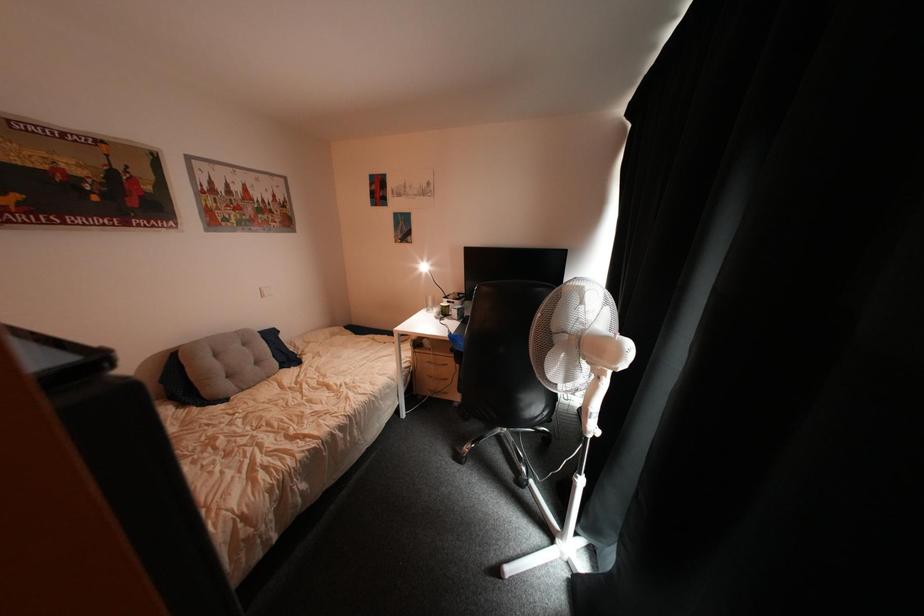
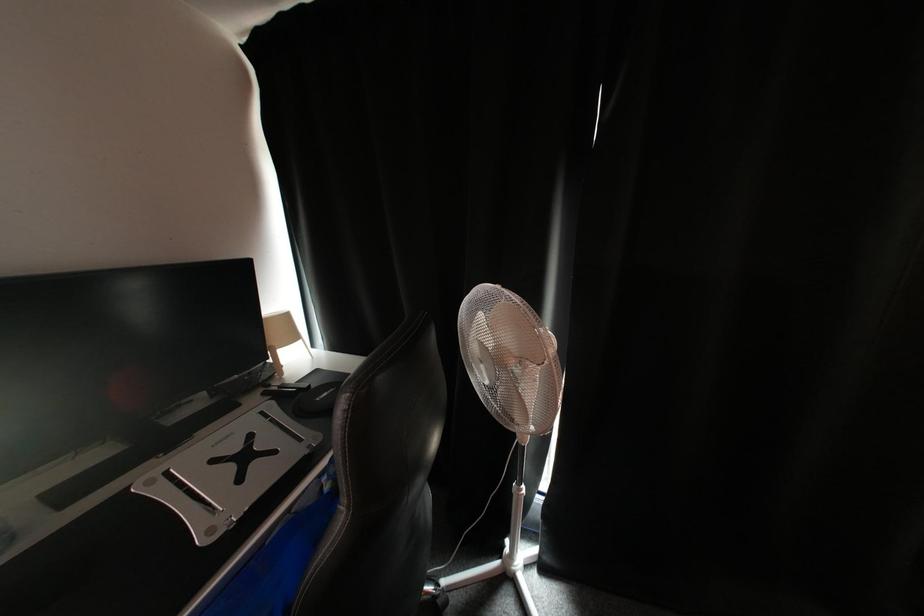
The first image is from the beginning of the video and the second image is from the end. How did the camera likely rotate when shooting the video?

The camera rotated toward right-down.